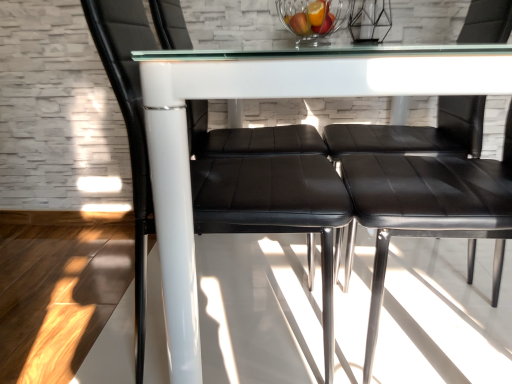
What are the coordinates of `vacant space to the left of black leather chair at left, positioned as the first chair in left-to-right order` in the screenshot? It's located at (77, 317).